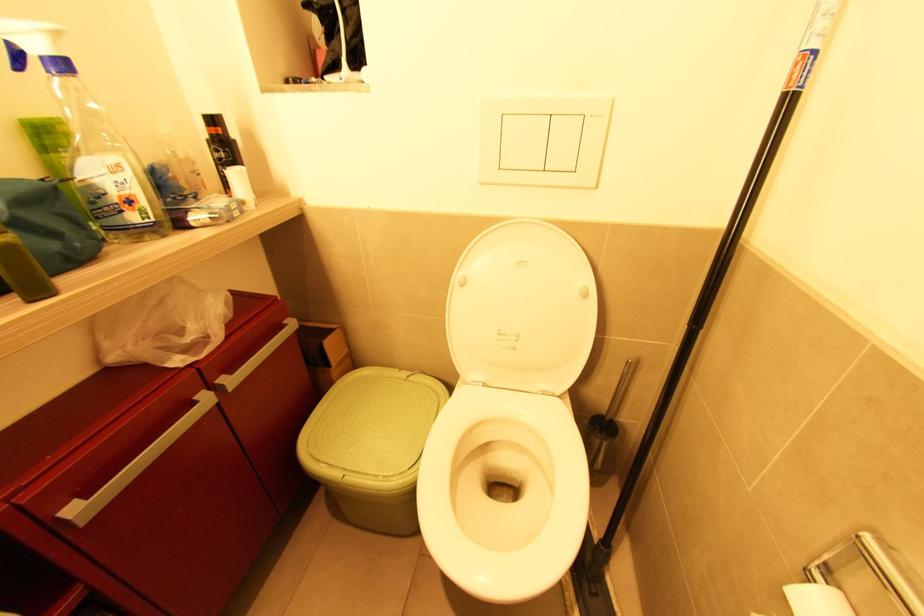
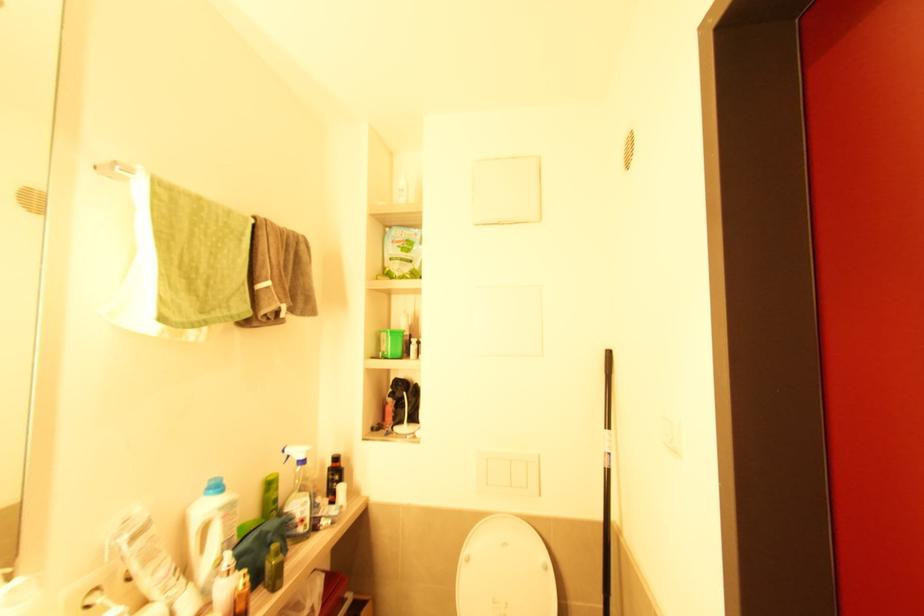
Find the pixel in the second image that matches (x=124, y=213) in the first image.

(298, 527)